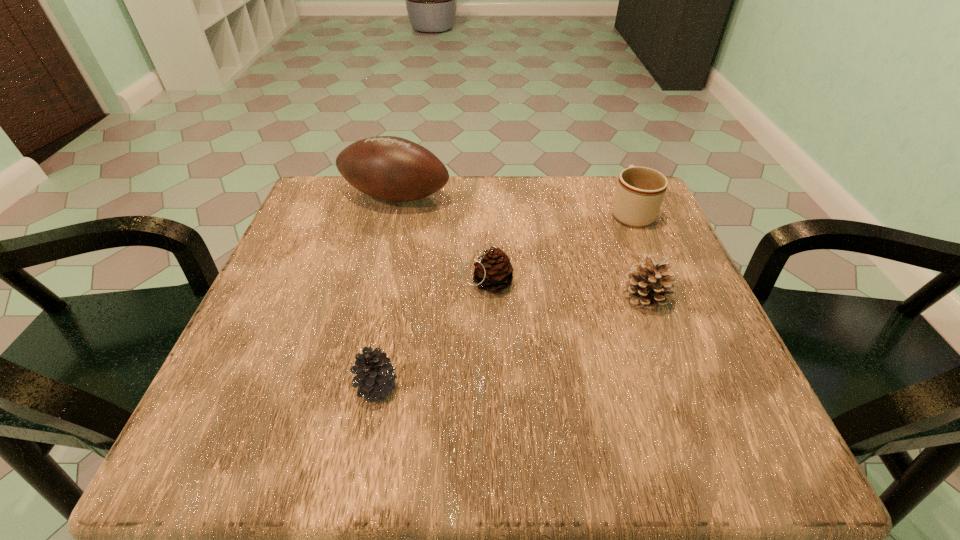
At what (x,y) coordinates should I click in order to perform the action: click on free point that satisfies the following two spatial constraints: 1. with a leaf charm attached to the rightmost pinecone; 2. on the left side of the third object from left to right. Please return your answer as a coordinate pair (x, y). The width and height of the screenshot is (960, 540). Looking at the image, I should click on click(488, 297).

Identify the location of free space in the image that satisfies the following two spatial constraints: 1. with a leaf charm attached to the third object from left to right; 2. on the left side of the rightmost pinecone. (488, 297).